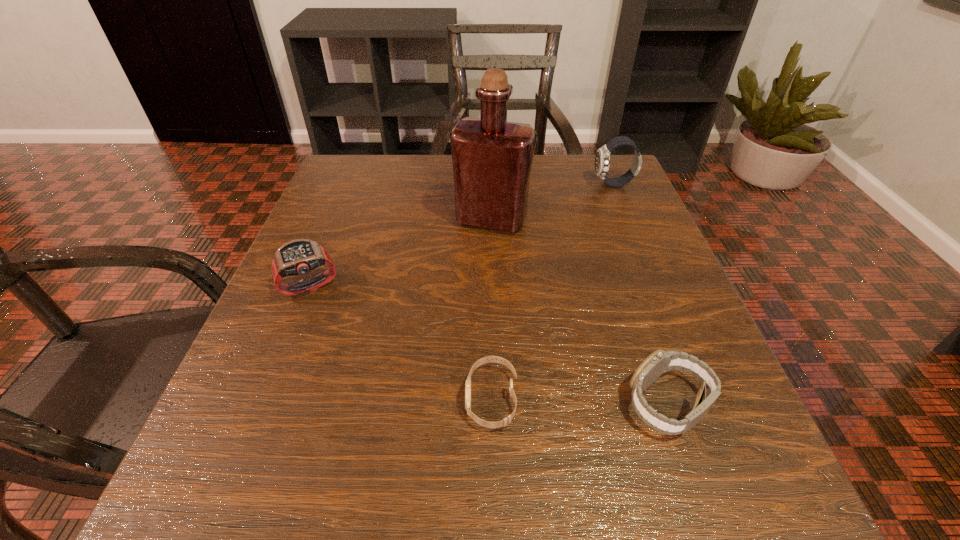
This screenshot has height=540, width=960. What are the coordinates of `watch that is the closest to the fourth nearest object` in the screenshot? It's located at (602, 160).

Locate which watch is the second closest to the third nearest watch. Please provide its 2D coordinates. Your answer should be formatted as a tuple, i.e. [(x, y)], where the tuple contains the x and y coordinates of a point satisfying the conditions above.

[(660, 362)]

Locate an element on the screen. The image size is (960, 540). vacant region that satisfies the following two spatial constraints: 1. on the back side of the third farthest object; 2. on the right side of the tallest object is located at coordinates (337, 219).